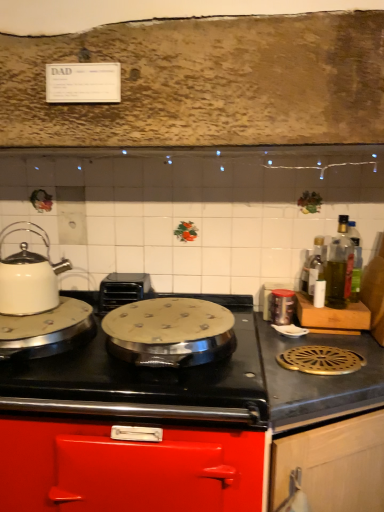
What do you see at coordinates (282, 306) in the screenshot?
I see `metallic canister at right, the 1th kitchen appliance viewed from the back` at bounding box center [282, 306].

What is the approximate height of white glossy kettle at left, which is the 1th kitchen appliance from left to right?

The height of white glossy kettle at left, which is the 1th kitchen appliance from left to right, is 9.96 inches.

What do you see at coordinates (123, 290) in the screenshot? I see `black plastic toaster at center-left` at bounding box center [123, 290].

Identify the location of wooden cabinet door at lower right, arranged as the second cabinetry when viewed from the left. The height and width of the screenshot is (512, 384). (334, 464).

The height and width of the screenshot is (512, 384). Find the location of `metallic canister at right, the second kitchen appliance when ordered from left to right`. metallic canister at right, the second kitchen appliance when ordered from left to right is located at coordinates (282, 306).

Between point (361, 262) and point (322, 275), which one is positioned in front?

Positioned in front is point (322, 275).

Is green glass bottle at right, the 3th bottle viewed from the left, shorter than clear glass bottle at right, the third bottle viewed from the right?

Incorrect, the height of green glass bottle at right, the 3th bottle viewed from the left, does not fall short of that of clear glass bottle at right, the third bottle viewed from the right.

Find the location of a particular element. The image size is (384, 512). bottle behind the green glass bottle at right, positioned as the first bottle in right-to-left order is located at coordinates (316, 265).

Looking at this image, how far apart are green glass bottle at right, the 3th bottle viewed from the left, and clear glass bottle at right, placed as the 1th bottle when sorted from left to right?

The distance of green glass bottle at right, the 3th bottle viewed from the left, from clear glass bottle at right, placed as the 1th bottle when sorted from left to right, is 4.57 inches.

How much distance is there between white glossy kettle at left, which is the 1th kitchen appliance from left to right, and black plastic toaster at center-left?

24.22 centimeters.

From a real-world perspective, is white glossy kettle at left, which is the 2th kitchen appliance in back-to-front order, above or below black plastic toaster at center-left?

Clearly, from a real-world perspective, white glossy kettle at left, which is the 2th kitchen appliance in back-to-front order, is above black plastic toaster at center-left.

Considering the relative positions of white glossy kettle at left, the 2th kitchen appliance viewed from the right, and black plastic toaster at center-left in the image provided, is white glossy kettle at left, the 2th kitchen appliance viewed from the right, to the right of black plastic toaster at center-left from the viewer's perspective?

In fact, white glossy kettle at left, the 2th kitchen appliance viewed from the right, is to the left of black plastic toaster at center-left.

Identify the location of kitchen appliance above the black plastic toaster at center-left (from a real-world perspective). Image resolution: width=384 pixels, height=512 pixels. pos(29,275).

Are green glass bottle at right, which is counted as the 2th bottle, starting from the left, and silver metallic wok at center far apart?

green glass bottle at right, which is counted as the 2th bottle, starting from the left, is actually quite close to silver metallic wok at center.

Does green glass bottle at right, the 2th bottle when ordered from right to left, have a lesser height compared to silver metallic wok at center?

No.

Considering the positions of points (332, 291) and (170, 333), is point (332, 291) closer to camera compared to point (170, 333)?

No, it is behind (170, 333).

Can you confirm if clear glass bottle at right, the third bottle viewed from the right, is positioned to the left of green glass bottle at right, which is counted as the 2th bottle, starting from the left?

Correct, you'll find clear glass bottle at right, the third bottle viewed from the right, to the left of green glass bottle at right, which is counted as the 2th bottle, starting from the left.

Can you confirm if clear glass bottle at right, the third bottle viewed from the right, is smaller than green glass bottle at right, which is counted as the 2th bottle, starting from the left?

Yes, clear glass bottle at right, the third bottle viewed from the right, is smaller than green glass bottle at right, which is counted as the 2th bottle, starting from the left.

From the image's perspective, between clear glass bottle at right, placed as the 1th bottle when sorted from left to right, and green glass bottle at right, the 2th bottle when ordered from right to left, who is located below?

From the image's view, clear glass bottle at right, placed as the 1th bottle when sorted from left to right, is below.

From a real-world perspective, is clear glass bottle at right, the third bottle viewed from the right, physically below green glass bottle at right, which is counted as the 2th bottle, starting from the left?

Correct, in the physical world, clear glass bottle at right, the third bottle viewed from the right, is lower than green glass bottle at right, which is counted as the 2th bottle, starting from the left.

From a real-world perspective, between clear glass bottle at right, placed as the 1th bottle when sorted from left to right, and wooden cabinet door at lower right, arranged as the second cabinetry when viewed from the left, who is vertically higher?

clear glass bottle at right, placed as the 1th bottle when sorted from left to right, from a real-world perspective.

Is clear glass bottle at right, placed as the 1th bottle when sorted from left to right, aimed at wooden cabinet door at lower right, arranged as the second cabinetry when viewed from the left?

No.

Considering the sizes of objects clear glass bottle at right, the third bottle viewed from the right, and wooden cabinet door at lower right, arranged as the second cabinetry when viewed from the left, in the image provided, who is shorter, clear glass bottle at right, the third bottle viewed from the right, or wooden cabinet door at lower right, arranged as the second cabinetry when viewed from the left,?

Standing shorter between the two is clear glass bottle at right, the third bottle viewed from the right.

Starting from the wooden cabinet door at lower right, arranged as the second cabinetry when viewed from the left, which bottle is the 3rd one behind? Please provide its 2D coordinates.

[(316, 265)]

Can you confirm if metallic canister at right, positioned as the 2th kitchen appliance in front-to-back order, is thinner than green glass bottle at right, positioned as the first bottle in right-to-left order?

No.

Which of these two, metallic canister at right, the 1th kitchen appliance viewed from the back, or green glass bottle at right, positioned as the first bottle in right-to-left order, stands taller?

Standing taller between the two is green glass bottle at right, positioned as the first bottle in right-to-left order.

Can we say metallic canister at right, the 1th kitchen appliance viewed from the back, lies outside green glass bottle at right, the 3th bottle viewed from the left?

metallic canister at right, the 1th kitchen appliance viewed from the back, is positioned outside green glass bottle at right, the 3th bottle viewed from the left.

From a real-world perspective, is metallic gray stovetop at right beneath white glossy kettle at left, the 2th kitchen appliance viewed from the right?

Yes, from a real-world perspective, metallic gray stovetop at right is under white glossy kettle at left, the 2th kitchen appliance viewed from the right.

The width and height of the screenshot is (384, 512). What are the coordinates of `counter top on the right of white glossy kettle at left, which is the 2th kitchen appliance in back-to-front order` in the screenshot? It's located at (319, 380).

Does metallic gray stovetop at right have a lesser width compared to white glossy kettle at left, which is the 2th kitchen appliance in back-to-front order?

No.

From the image's perspective, would you say metallic gray stovetop at right is positioned over white glossy kettle at left, which appears as the 1th kitchen appliance when viewed from the front?

No, from the image's perspective, metallic gray stovetop at right is not over white glossy kettle at left, which appears as the 1th kitchen appliance when viewed from the front.

At what (x,y) coordinates should I click in order to perform the action: click on bottle that is the 1st one when counting forward from the clear glass bottle at right, the third bottle viewed from the right. Please return your answer as a coordinate pair (x, y). Looking at the image, I should click on point(355,261).

The image size is (384, 512). I want to click on kitchen appliance that is on the left side of black plastic toaster at center-left, so click(x=29, y=275).

When comparing their distances from clear glass bottle at right, the third bottle viewed from the right, does green glass bottle at right, positioned as the first bottle in right-to-left order, or wooden cabinet door at lower right, arranged as the second cabinetry when viewed from the left, seem further?

Among the two, wooden cabinet door at lower right, arranged as the second cabinetry when viewed from the left, is located further to clear glass bottle at right, the third bottle viewed from the right.

From the image, which object appears to be farther from metallic red cabinet at center, which is the 2th cabinetry in right-to-left order, metallic canister at right, arranged as the 1th kitchen appliance when viewed from the right, or white glossy kettle at left, which appears as the 1th kitchen appliance when viewed from the front?

white glossy kettle at left, which appears as the 1th kitchen appliance when viewed from the front, is further to metallic red cabinet at center, which is the 2th cabinetry in right-to-left order.

Considering their positions, is green glass bottle at right, positioned as the first bottle in right-to-left order, positioned further to metallic canister at right, the 1th kitchen appliance viewed from the back, than clear glass bottle at right, placed as the 1th bottle when sorted from left to right?

green glass bottle at right, positioned as the first bottle in right-to-left order.

Which object lies further to the anchor point black plastic toaster at center-left, green glass bottle at right, positioned as the first bottle in right-to-left order, or white glossy kettle at left, which is the 1th kitchen appliance from left to right?

green glass bottle at right, positioned as the first bottle in right-to-left order.

When comparing their distances from metallic gray stovetop at right, does metallic canister at right, arranged as the 1th kitchen appliance when viewed from the right, or wooden cabinet door at lower right, arranged as the second cabinetry when viewed from the left, seem closer?

Among the two, wooden cabinet door at lower right, arranged as the second cabinetry when viewed from the left, is located nearer to metallic gray stovetop at right.

Which object lies further to the anchor point metallic canister at right, arranged as the 1th kitchen appliance when viewed from the right, wooden cabinet door at lower right, the 1th cabinetry viewed from the right, or green glass bottle at right, positioned as the first bottle in right-to-left order?

wooden cabinet door at lower right, the 1th cabinetry viewed from the right.

Which object lies nearer to the anchor point black plastic toaster at center-left, metallic gray stovetop at right or green glass bottle at right, the 2th bottle when ordered from right to left?

metallic gray stovetop at right is positioned closer to the anchor black plastic toaster at center-left.

When comparing their distances from green glass bottle at right, the 2th bottle when ordered from right to left, does silver metallic wok at center or clear glass bottle at right, placed as the 1th bottle when sorted from left to right, seem closer?

clear glass bottle at right, placed as the 1th bottle when sorted from left to right, is positioned closer to the anchor green glass bottle at right, the 2th bottle when ordered from right to left.

The image size is (384, 512). I want to click on cabinetry between wooden cabinet door at lower right, arranged as the second cabinetry when viewed from the left, and black plastic toaster at center-left, along the z-axis, so click(190, 429).

You are a GUI agent. You are given a task and a screenshot of the screen. Output one action in this format:
    pyautogui.click(x=<x>, y=<y>)
    Task: Click on the bottle between metallic red cabinet at center, which is the 2th cabinetry in right-to-left order, and metallic gray stovetop at right from left to right
    This screenshot has height=512, width=384.
    Given the screenshot: What is the action you would take?
    pyautogui.click(x=316, y=265)

Where is `counter top between metallic red cabinet at center, the 1th cabinetry positioned from the left, and green glass bottle at right, positioned as the first bottle in right-to-left order, from left to right`? counter top between metallic red cabinet at center, the 1th cabinetry positioned from the left, and green glass bottle at right, positioned as the first bottle in right-to-left order, from left to right is located at coordinates (319, 380).

Where is `kitchen appliance that lies between clear glass bottle at right, placed as the 1th bottle when sorted from left to right, and metallic gray stovetop at right from top to bottom`? kitchen appliance that lies between clear glass bottle at right, placed as the 1th bottle when sorted from left to right, and metallic gray stovetop at right from top to bottom is located at coordinates (282, 306).